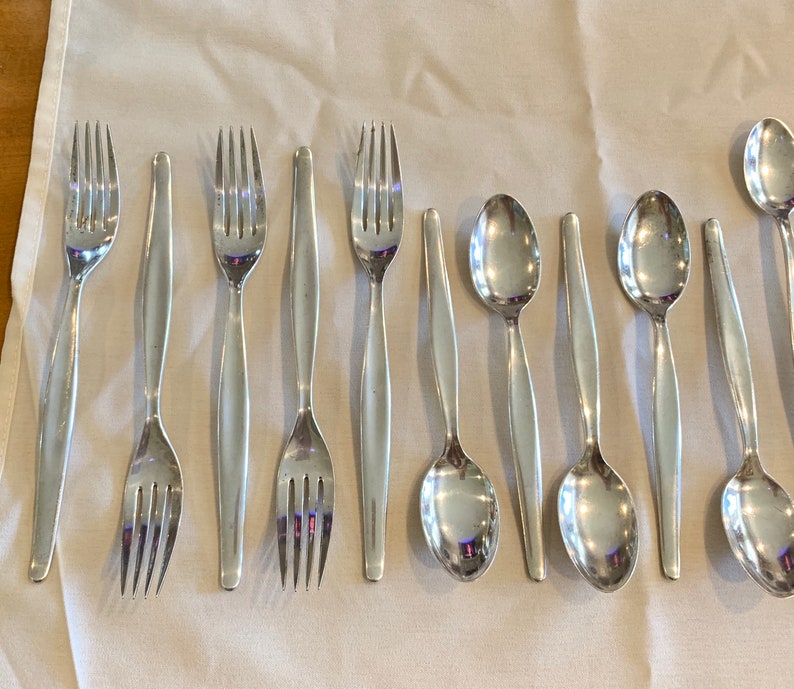
The height and width of the screenshot is (689, 794). I want to click on spoon, so click(x=456, y=502), click(x=510, y=263), click(x=613, y=517), click(x=663, y=267), click(x=750, y=506), click(x=771, y=174).